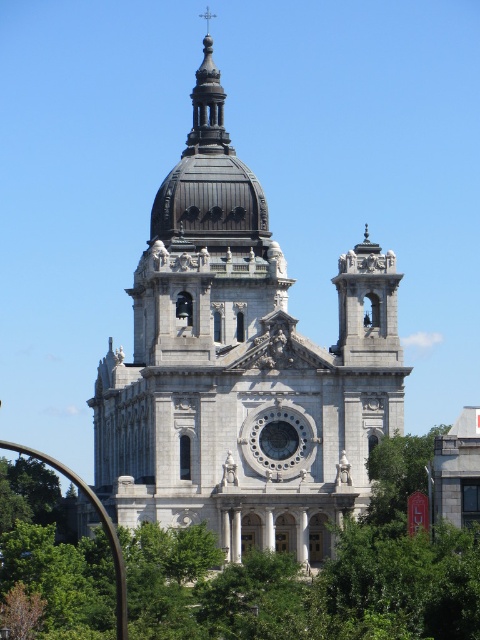
Question: Is the position of green leafy tree at center less distant than that of green leafy tree at lower right?

Choices:
 (A) yes
 (B) no

Answer: (A)

Question: Based on their relative distances, which object is farther from the green leafy tree at lower right?

Choices:
 (A) green leafy tree at center
 (B) white stone church at center

Answer: (B)

Question: Which of the following is the farthest from the observer?

Choices:
 (A) green leafy tree at lower right
 (B) green leafy tree at center
 (C) white stone church at center

Answer: (C)

Question: Does green leafy tree at center lie behind green leafy tree at lower right?

Choices:
 (A) no
 (B) yes

Answer: (A)

Question: Can you confirm if white stone church at center is positioned above green leafy tree at lower right?

Choices:
 (A) yes
 (B) no

Answer: (A)

Question: Which of the following is the farthest from the observer?

Choices:
 (A) (436, 557)
 (B) (397, 515)
 (C) (243, 212)

Answer: (C)